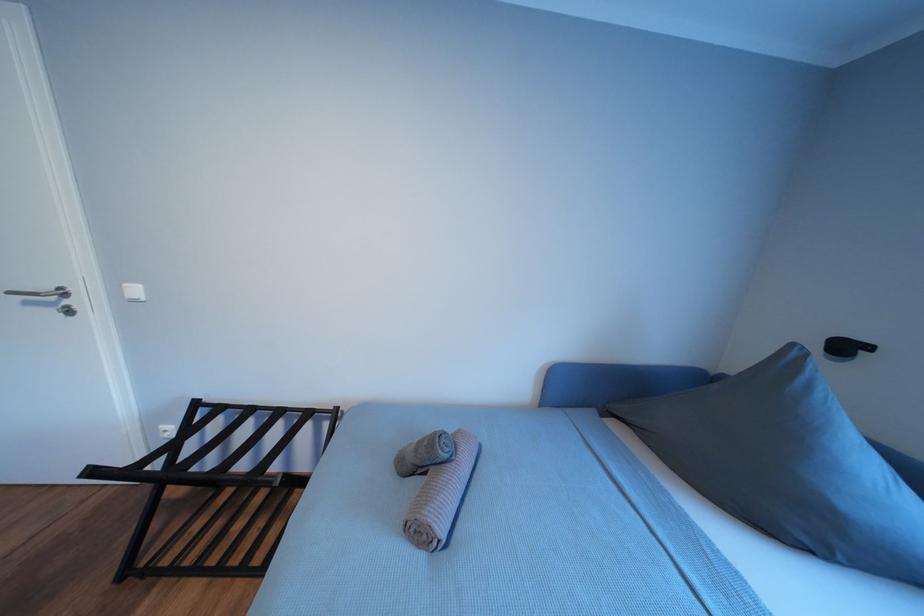
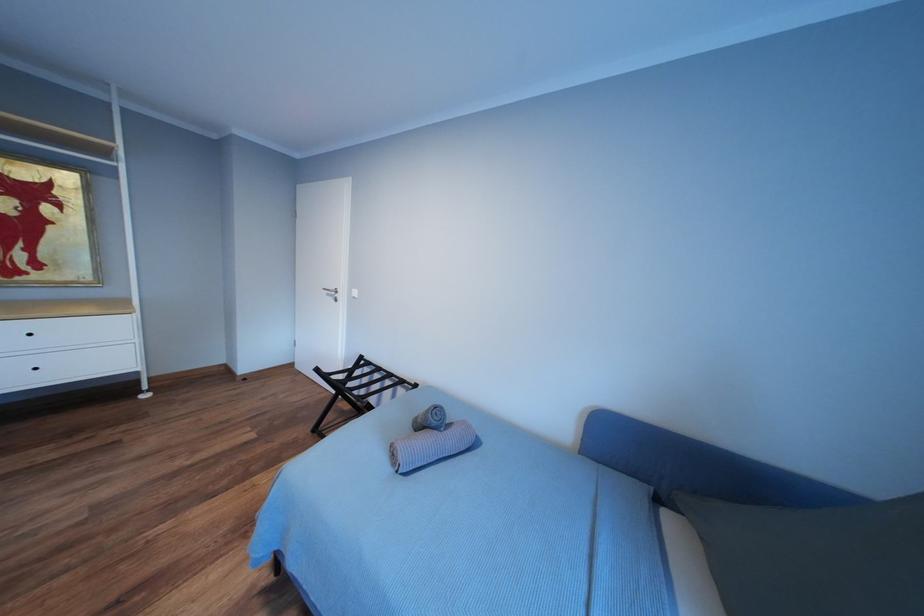
Question: The images are taken continuously from a first-person perspective. In which direction is your viewpoint rotating?

Choices:
 (A) Left
 (B) Right
 (C) Up
 (D) Down

Answer: (A)